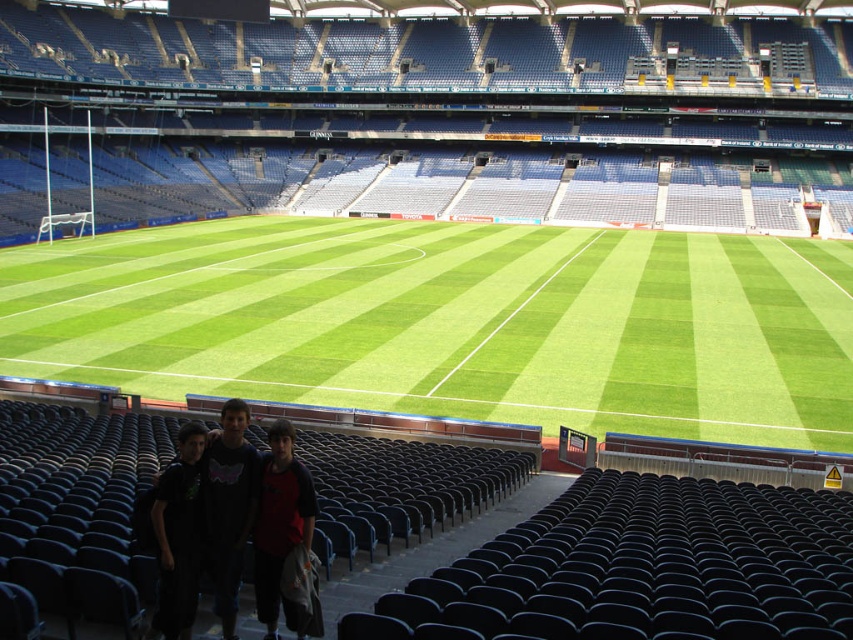
Question: Does green artificial turf at center appear over black matte shirt at lower left?

Choices:
 (A) yes
 (B) no

Answer: (A)

Question: Which of the following is the farthest from the observer?

Choices:
 (A) (242, 436)
 (B) (302, 499)

Answer: (A)

Question: Which object is positioned farthest from the red fabric shirt at lower center?

Choices:
 (A) black cotton shirt at lower center
 (B) dark blue t-shirt at lower center
 (C) black matte shirt at lower left
 (D) green artificial turf at center

Answer: (D)

Question: Which point is closer to the camera taking this photo?

Choices:
 (A) (192, 518)
 (B) (310, 532)

Answer: (B)

Question: Is the position of green artificial turf at center more distant than that of black cotton shirt at lower center?

Choices:
 (A) yes
 (B) no

Answer: (A)

Question: Is green artificial turf at center closer to camera compared to black matte shirt at lower left?

Choices:
 (A) no
 (B) yes

Answer: (A)